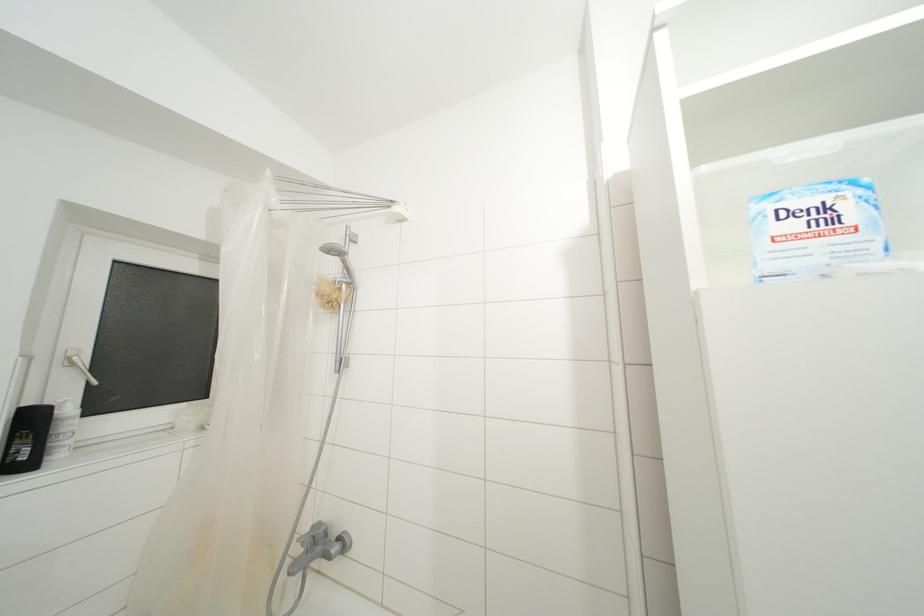
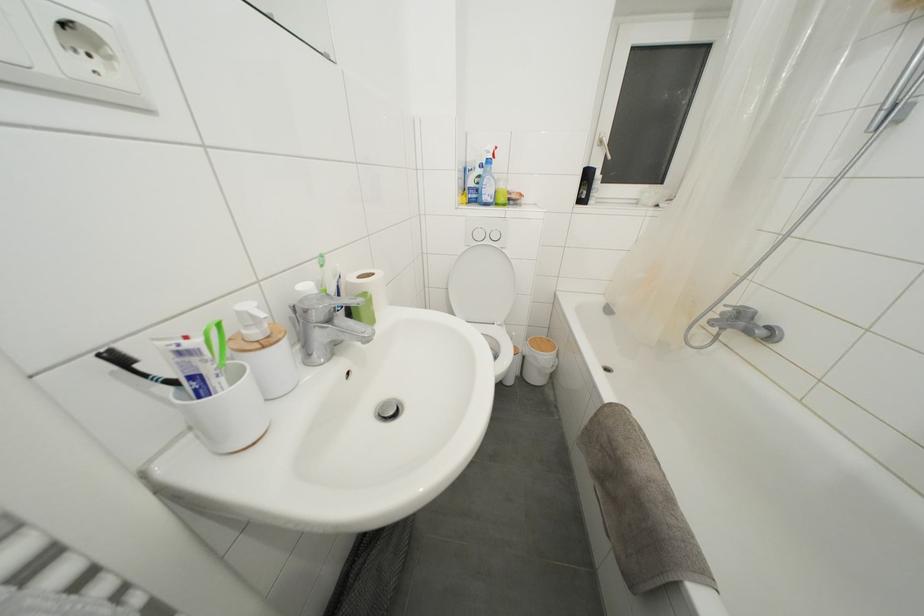
The point at [76,368] is marked in the first image. Where is the corresponding point in the second image?

(604, 148)